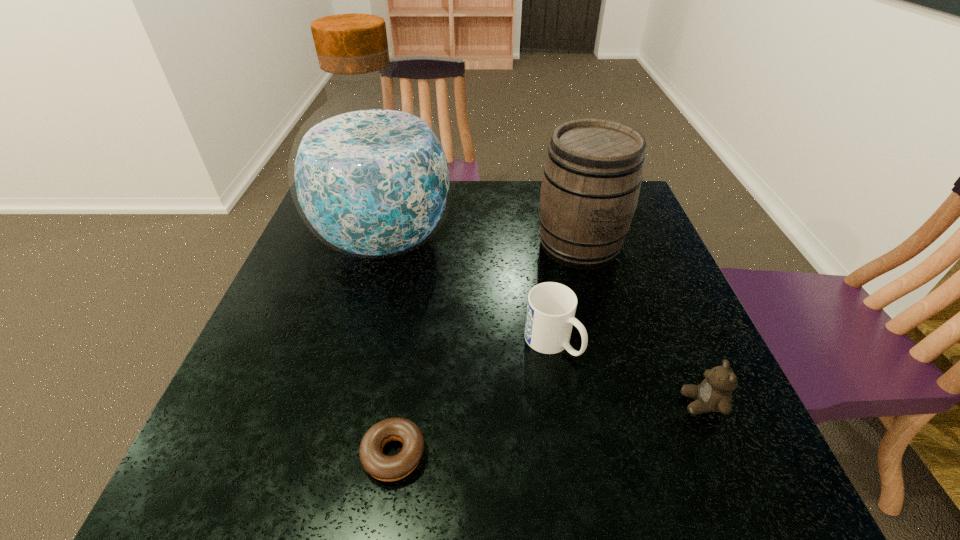
Find the location of a particular element. The image size is (960, 540). the tallest object is located at coordinates (371, 175).

Where is `the second tallest object`? the second tallest object is located at coordinates (592, 176).

Find the location of a particular element. the third nearest object is located at coordinates (551, 307).

Where is `teddy bear`? The height and width of the screenshot is (540, 960). teddy bear is located at coordinates [x=714, y=394].

The image size is (960, 540). What are the coordinates of `doughnut` in the screenshot? It's located at (386, 468).

Identify the location of vacant space located 0.150m on the front of the tallest object. (360, 336).

The height and width of the screenshot is (540, 960). What are the coordinates of `vacant area situated on the back of the wine bucket` in the screenshot? It's located at (564, 192).

Locate an element on the screen. free space located 0.100m on the front of the mug is located at coordinates (563, 410).

Where is `free location located 0.240m on the face of the teddy bear`? The width and height of the screenshot is (960, 540). free location located 0.240m on the face of the teddy bear is located at coordinates (555, 403).

I want to click on free space located 0.400m on the face of the teddy bear, so click(x=469, y=403).